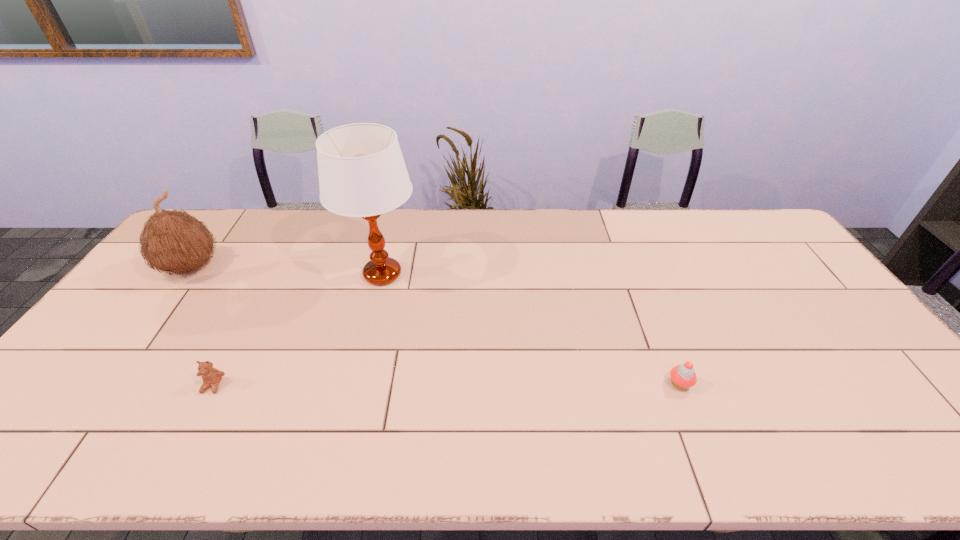
Locate an element on the screen. object at the far edge is located at coordinates 172,241.

What are the coordinates of `object that is at the left edge` in the screenshot? It's located at (172, 241).

I want to click on object located at the far left corner, so click(x=172, y=241).

This screenshot has height=540, width=960. I want to click on vacant space at the far edge, so click(302, 221).

Image resolution: width=960 pixels, height=540 pixels. What are the coordinates of `vacant space at the near edge of the desktop` in the screenshot? It's located at (501, 465).

The height and width of the screenshot is (540, 960). What are the coordinates of `vacant area at the left edge` in the screenshot? It's located at [109, 356].

The image size is (960, 540). In order to click on vacant space at the right edge in this screenshot , I will do `click(804, 325)`.

Locate an element on the screen. This screenshot has height=540, width=960. vacant position at the far right corner of the desktop is located at coordinates (752, 219).

Locate an element on the screen. Image resolution: width=960 pixels, height=540 pixels. vacant space in between the coconut and the second object from left to right is located at coordinates tap(202, 327).

The width and height of the screenshot is (960, 540). I want to click on empty space between the rightmost object and the teddy bear, so click(x=446, y=384).